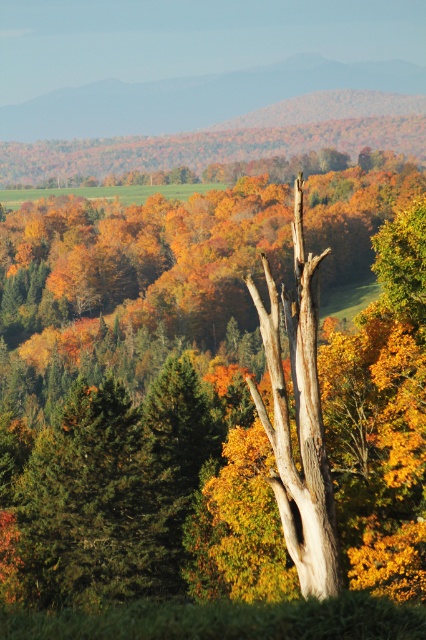
You are a bird looking for a nesting spot. You see the smooth bark tree at center and the green matte tree at left. Which tree is taller and better suited for nesting?

The smooth bark tree at center is much taller than the green matte tree at left, making it better suited for nesting due to its height.

You are standing in the autumn landscape and want to take a photo of the smooth bark tree at center. If your camera can focus on objects up to 20 meters away, will you need to move closer to get a clear shot?

The smooth bark tree at center is 22.02 meters from the camera, which is beyond the camera focus range of 20 meters. To get a clear shot, you need to move closer to reduce the distance.